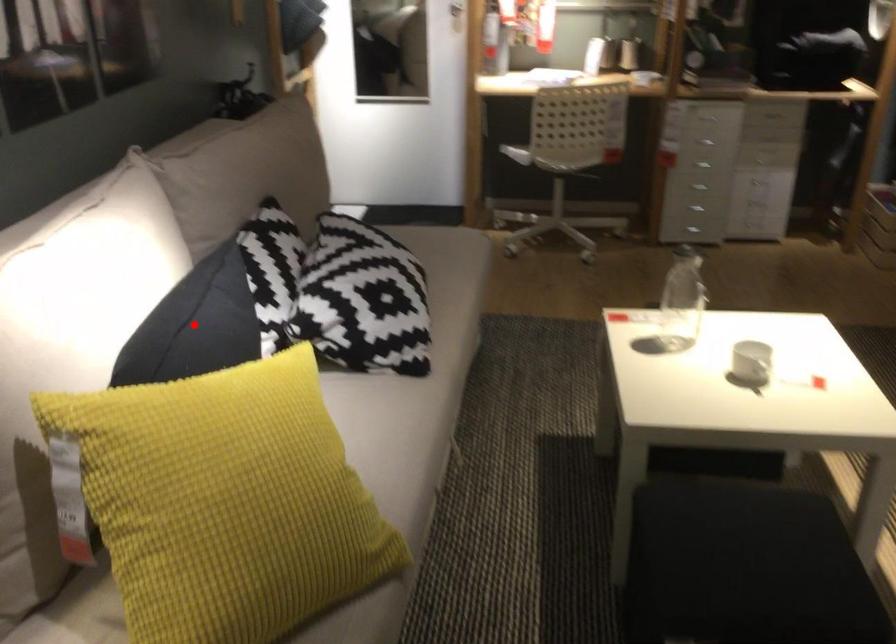
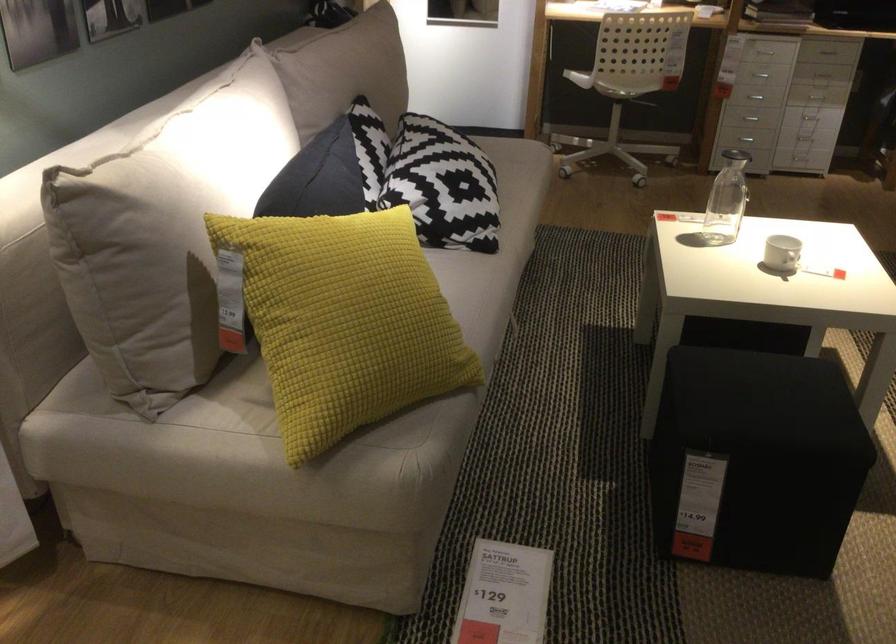
Question: I am providing you with two images of the same scene from different viewpoints. Image1 has a red point marked. In image2, the corresponding 3D location appears at what relative position? Reply with the corresponding letter.

Choices:
 (A) Closer
 (B) Farther

Answer: (B)